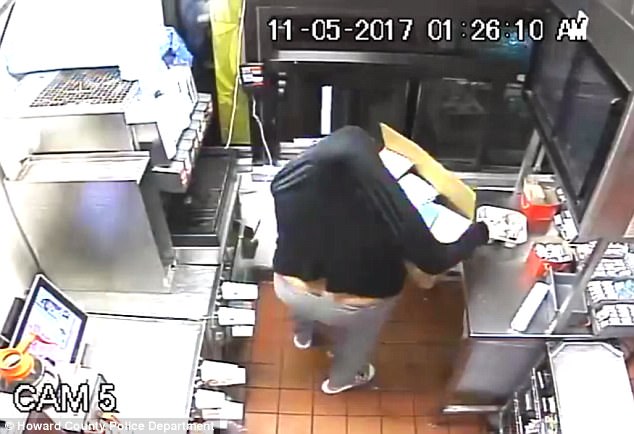
In order to click on brick floor in this screenshot , I will do `click(295, 377)`.